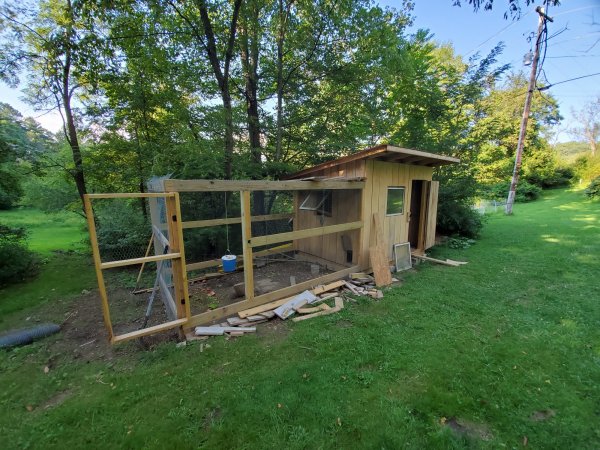
At what (x,y) coordinates should I click in order to perform the action: click on 1 bucket. Please return your answer as a coordinate pair (x, y). Image resolution: width=600 pixels, height=450 pixels. Looking at the image, I should click on point(224,262).